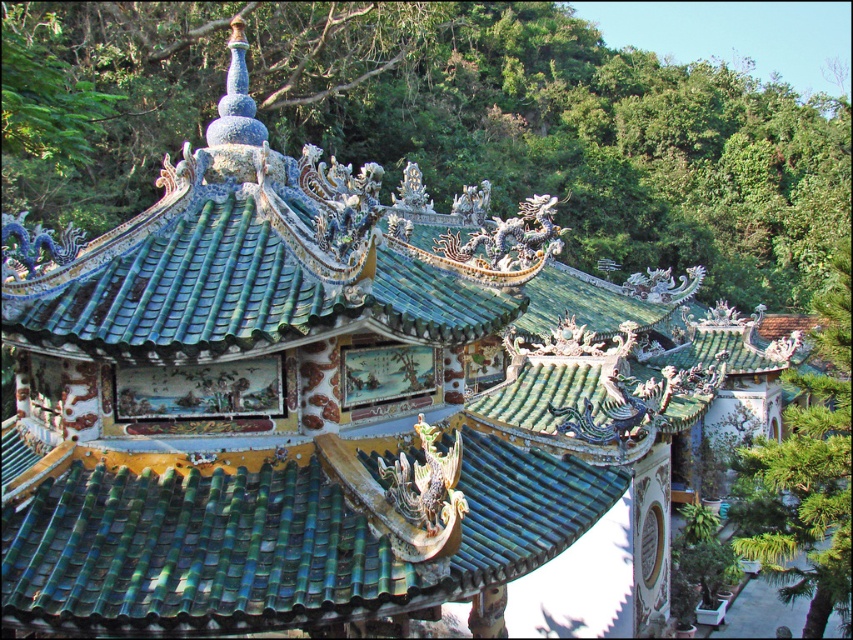
You are standing in front of the traditional Chinese pavilion described. There is a point marked at coordinates (271, 544). Based on the scene description, what is located at this point?

The point at coordinates (271, 544) marks the green glazed tiles at center.